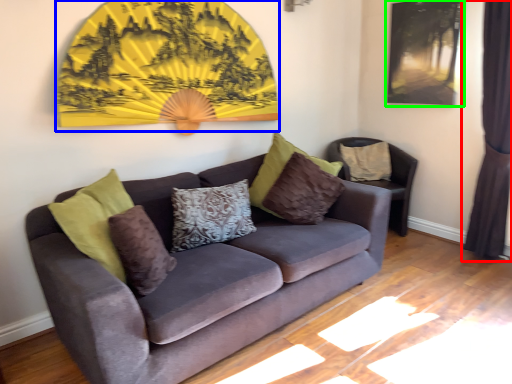
Question: Based on their relative distances, which object is farther from curtain (highlighted by a red box)? Choose from decor (highlighted by a blue box) and picture frame (highlighted by a green box).

Choices:
 (A) decor
 (B) picture frame

Answer: (A)